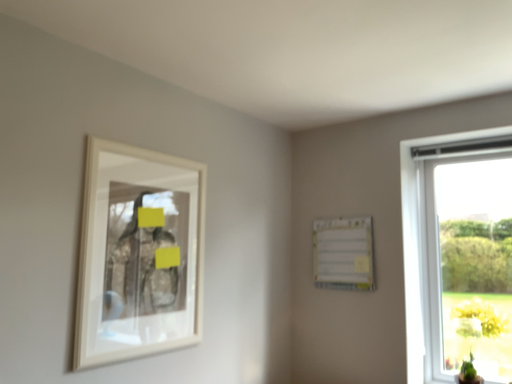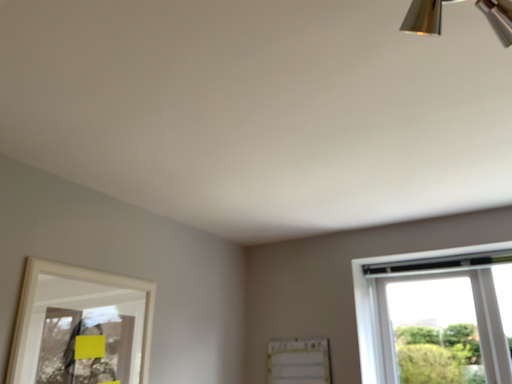
Question: Which way did the camera rotate in the video?

Choices:
 (A) rotated right
 (B) rotated left

Answer: (A)